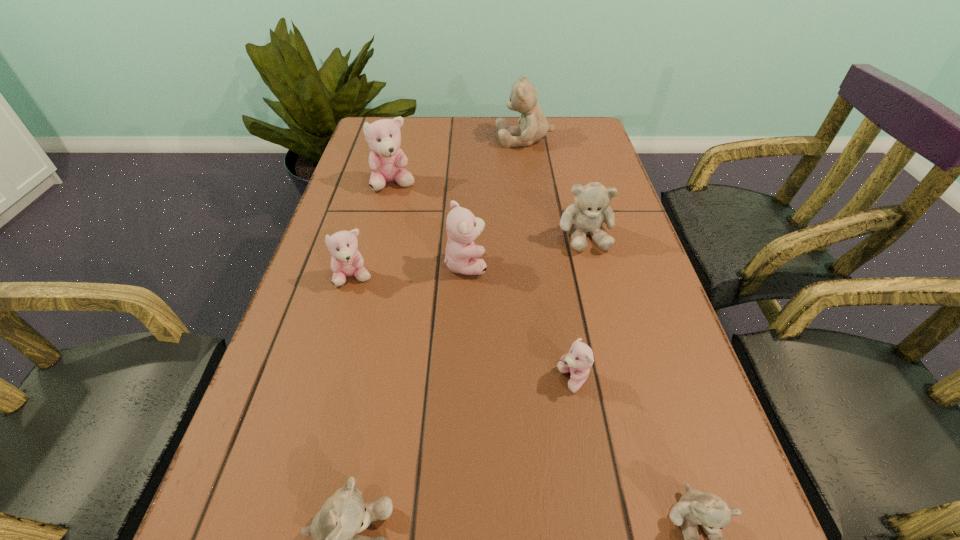
You are a GUI agent. You are given a task and a screenshot of the screen. Output one action in this format:
    pyautogui.click(x=<x>, y=<y>)
    Task: Click on the object situated at the far edge
    This screenshot has width=960, height=540.
    Given the screenshot: What is the action you would take?
    pyautogui.click(x=533, y=127)

Image resolution: width=960 pixels, height=540 pixels. What are the coordinates of `object situated at the far right corner` in the screenshot? It's located at pyautogui.click(x=533, y=127).

Identify the location of vacant space at the far edge of the desktop. (472, 150).

Where is `free space at the left edge`? This screenshot has width=960, height=540. free space at the left edge is located at coordinates (350, 170).

In the image, there is a desktop. Identify the location of vacant space at the right edge. This screenshot has width=960, height=540. (601, 377).

Image resolution: width=960 pixels, height=540 pixels. In the image, there is a desktop. Find the location of `free space at the far right corner`. free space at the far right corner is located at coordinates (562, 125).

You are a GUI agent. You are given a task and a screenshot of the screen. Output one action in this format:
    pyautogui.click(x=<x>, y=<y>)
    Task: Click on the free area in between the second smallest pink teddy bear and the second farthest object
    
    Given the screenshot: What is the action you would take?
    pyautogui.click(x=374, y=231)

The image size is (960, 540). Identify the location of empty space that is in between the biggest pink teddy bear and the third biggest pink teddy bear. (374, 231).

At what (x,y) coordinates should I click in order to perform the action: click on empty space that is in between the second farthest object and the fifth teddy bear from right to left. Please return your answer as a coordinate pair (x, y). Looking at the image, I should click on (430, 224).

I want to click on vacant point located between the second smallest pink teddy bear and the fifth object from right to left, so click(x=410, y=271).